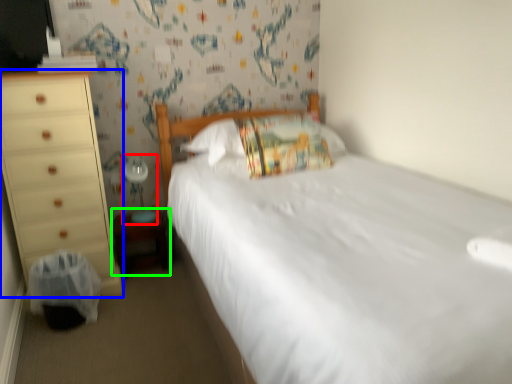
Question: Which is farther away from table lamp (highlighted by a red box)? chest of drawers (highlighted by a blue box) or changing table (highlighted by a green box)?

Choices:
 (A) chest of drawers
 (B) changing table

Answer: (A)